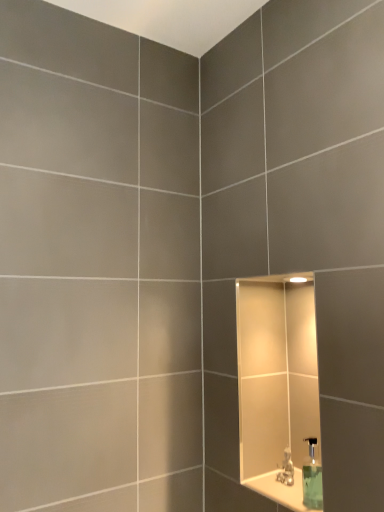
I want to click on vacant space in front of satin nickel faucet at lower right, so click(293, 499).